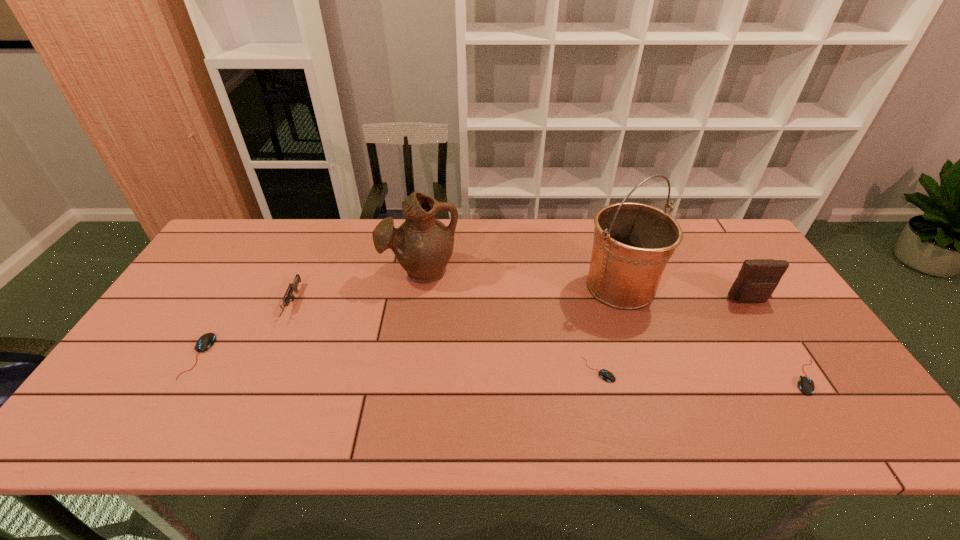
At what (x,y) coordinates should I click in order to perform the action: click on the tallest object. Please return your answer as a coordinate pair (x, y). The image size is (960, 540). Looking at the image, I should click on (633, 242).

This screenshot has height=540, width=960. I want to click on pouch, so click(x=758, y=278).

This screenshot has width=960, height=540. Identify the location of free space located 0.270m on the back of the tallest mouse. (251, 268).

Find the location of a particular element. vacant space located on the left of the shortest mouse is located at coordinates (507, 370).

Identify the location of free location located on the back of the second shortest mouse. Image resolution: width=960 pixels, height=540 pixels. (736, 269).

The width and height of the screenshot is (960, 540). Identify the location of vacant space located 0.290m at the spout of the pitcher. (406, 373).

Where is `vacant space situated 0.240m aimed along the barrel of the sixth object from right to left`? vacant space situated 0.240m aimed along the barrel of the sixth object from right to left is located at coordinates (249, 401).

I want to click on free space located 0.200m on the right of the tallest object, so click(x=725, y=286).

Locate an element on the screen. free space located with an open flap on the pouch is located at coordinates (787, 360).

This screenshot has width=960, height=540. What are the coordinates of `pitcher situated at the far edge` in the screenshot? It's located at (423, 245).